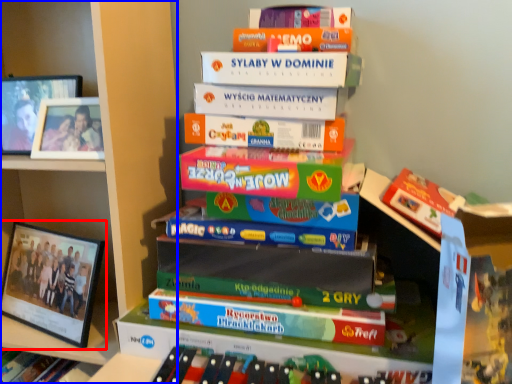
Question: Which object is further to the camera taking this photo, picture frame (highlighted by a red box) or bookcase (highlighted by a blue box)?

Choices:
 (A) picture frame
 (B) bookcase

Answer: (A)